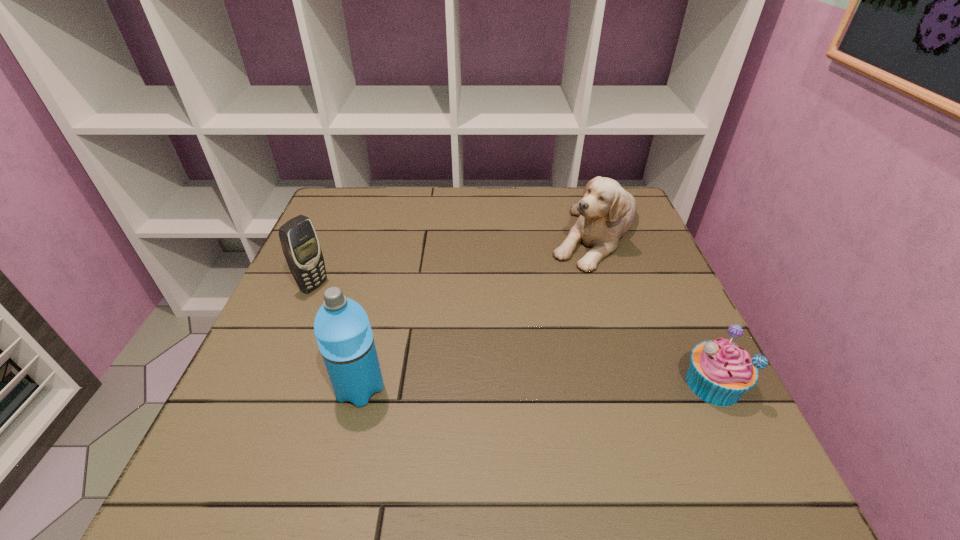
At what (x,y) coordinates should I click in order to perform the action: click on vacant area situated on the front-facing side of the farthest object. Please return your answer as a coordinate pair (x, y). Looking at the image, I should click on (574, 295).

Locate an element on the screen. This screenshot has width=960, height=540. vacant point located 0.210m on the front face of the cellular telephone is located at coordinates (396, 327).

The width and height of the screenshot is (960, 540). Find the location of `free region located 0.310m on the front face of the cellular telephone`. free region located 0.310m on the front face of the cellular telephone is located at coordinates (434, 346).

What are the coordinates of `vacant space located on the front face of the cellular telephone` in the screenshot? It's located at (363, 311).

Image resolution: width=960 pixels, height=540 pixels. What are the coordinates of `object that is at the far edge` in the screenshot? It's located at (606, 211).

Where is `thermos bottle at the near edge`? thermos bottle at the near edge is located at coordinates point(342,329).

Locate an element on the screen. This screenshot has height=540, width=960. muffin that is at the near edge is located at coordinates (720, 372).

This screenshot has height=540, width=960. Find the location of `object located at the left edge`. object located at the left edge is located at coordinates (300, 244).

This screenshot has width=960, height=540. In order to click on muffin that is at the right edge in this screenshot , I will do `click(720, 372)`.

Where is `puppy present at the right edge`? The image size is (960, 540). puppy present at the right edge is located at coordinates (606, 211).